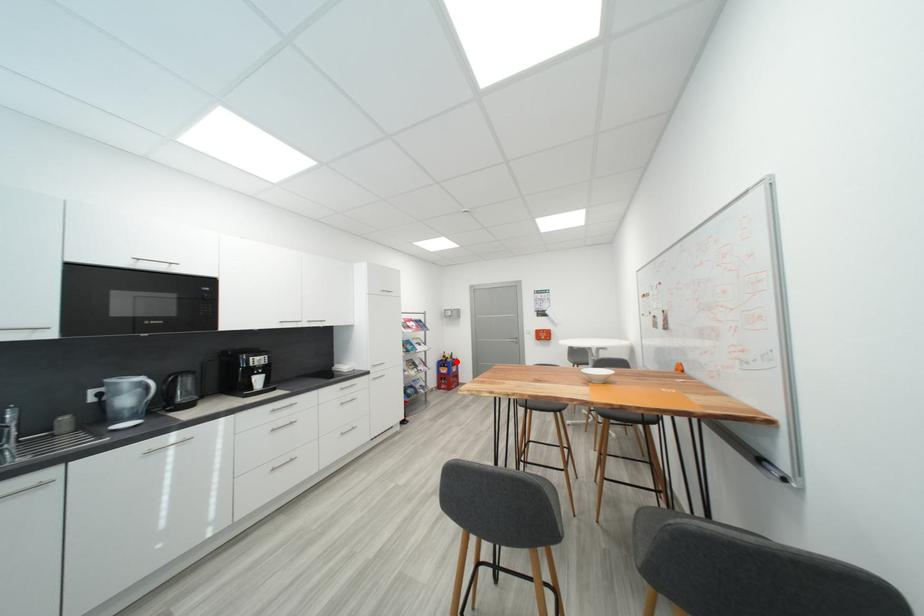
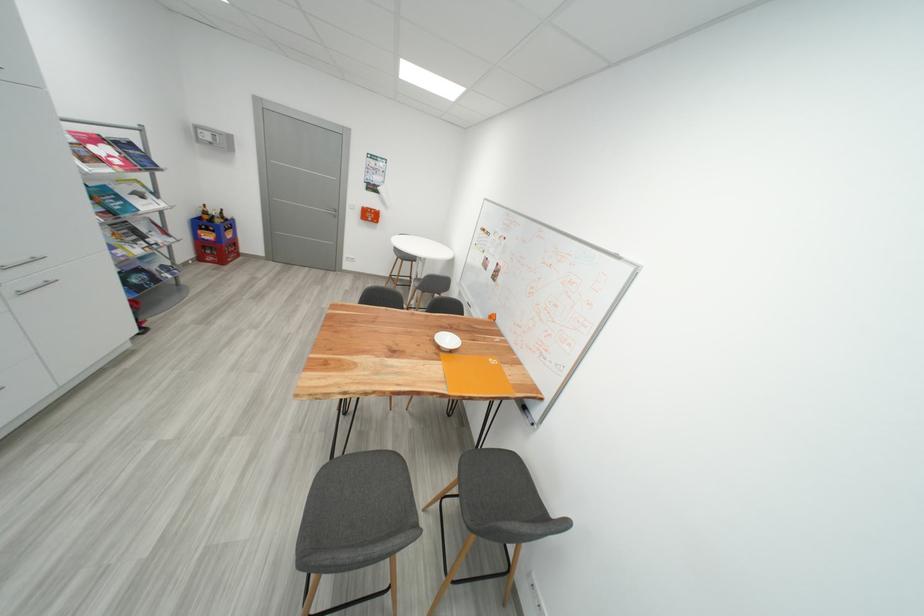
Question: A red point is marked in image1. In image2, is the corresponding 3D point closer to the camera or farther? Reply with the corresponding letter.

Choices:
 (A) The corresponding 3D point is closer.
 (B) The corresponding 3D point is farther.

Answer: (A)